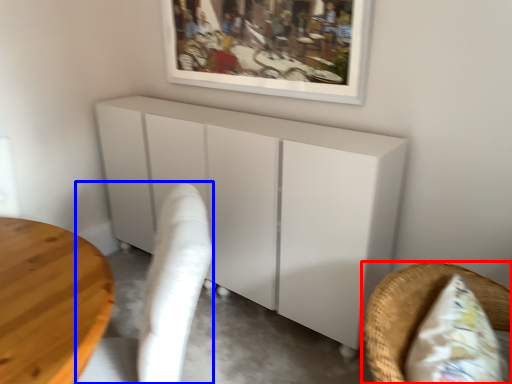
Question: Which object is closer to the camera taking this photo, furniture (highlighted by a red box) or swivel chair (highlighted by a blue box)?

Choices:
 (A) furniture
 (B) swivel chair

Answer: (A)